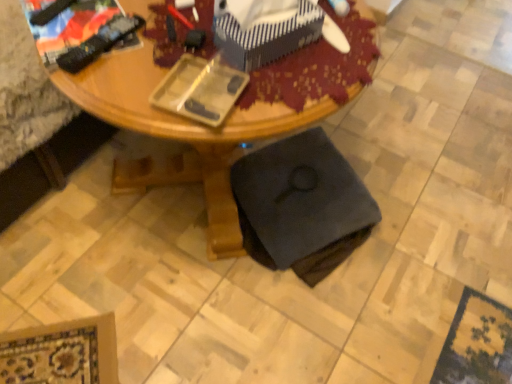
This screenshot has height=384, width=512. Identify the location of vacant area on top of wooden desk at center (from a real-world perspective). (190, 49).